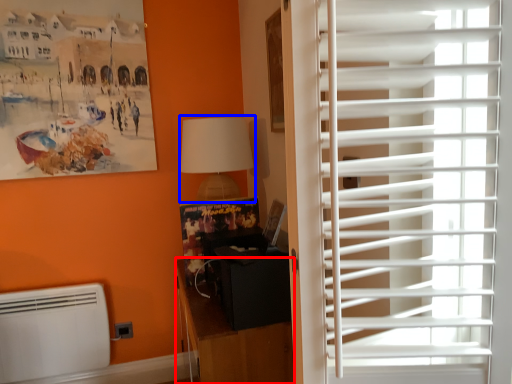
Question: Which object appears farthest to the camera in this image, furniture (highlighted by a red box) or lamp (highlighted by a blue box)?

Choices:
 (A) furniture
 (B) lamp

Answer: (B)